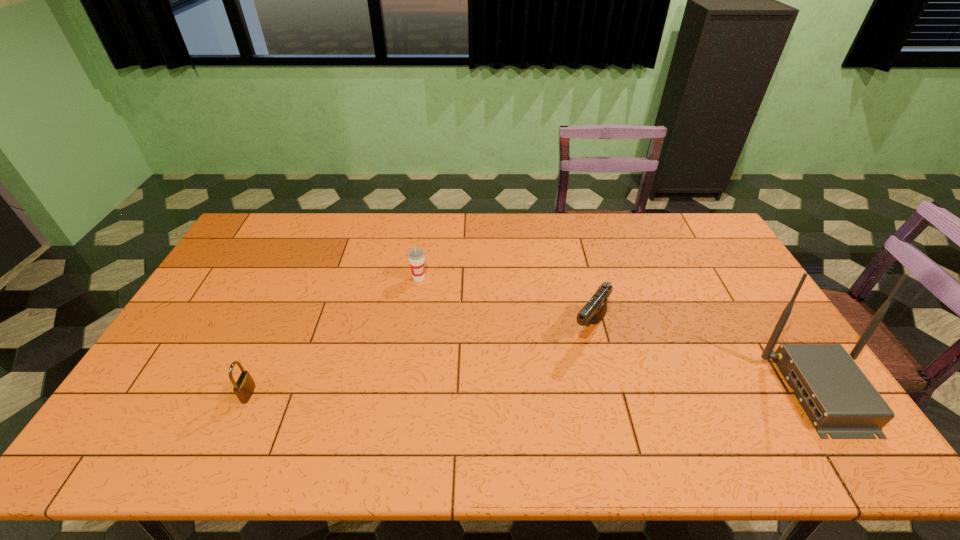
Identify the location of the leftmost object. (244, 387).

Find the location of `the rightmost object`. the rightmost object is located at coordinates (839, 399).

Identify the location of the tallest object. (839, 399).

Locate an element on the screen. pistol is located at coordinates (595, 309).

Locate an element on the screen. The width and height of the screenshot is (960, 540). the second farthest object is located at coordinates (595, 309).

Where is `the farthest object`? the farthest object is located at coordinates (416, 255).

Where is `cup`? This screenshot has width=960, height=540. cup is located at coordinates (416, 255).

Where is `vacant space located on the left of the padlock`? Image resolution: width=960 pixels, height=540 pixels. vacant space located on the left of the padlock is located at coordinates (151, 394).

Locate an element on the screen. vacant region located at the barrel of the third nearest object is located at coordinates (531, 409).

The height and width of the screenshot is (540, 960). Find the location of `blank area located at the barrel of the third nearest object`. blank area located at the barrel of the third nearest object is located at coordinates (554, 380).